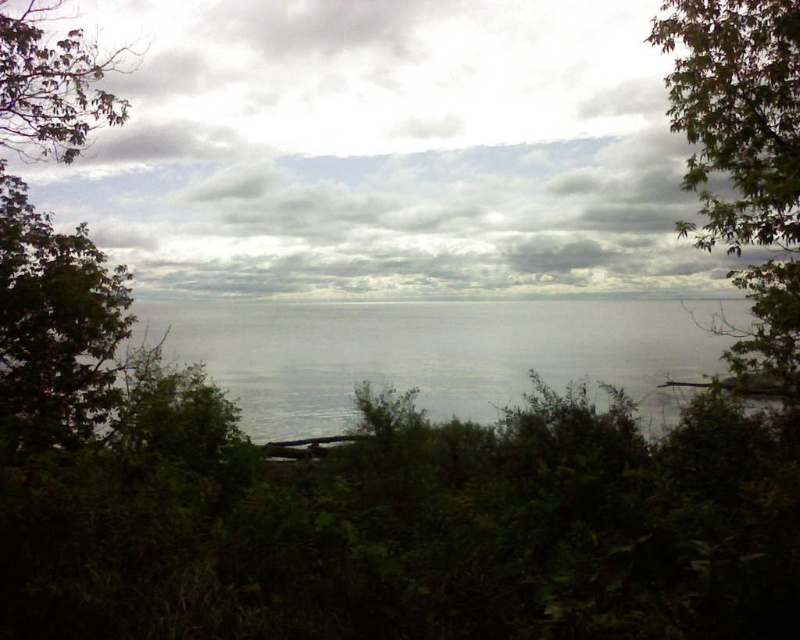
You are standing at the edge of the greenery in the foreground of the coastal scene. There is a point marked at coordinates (436,353). What is the location of this point relative to the transparent water at center?

The point at (436,353) is located on the transparent water at center.